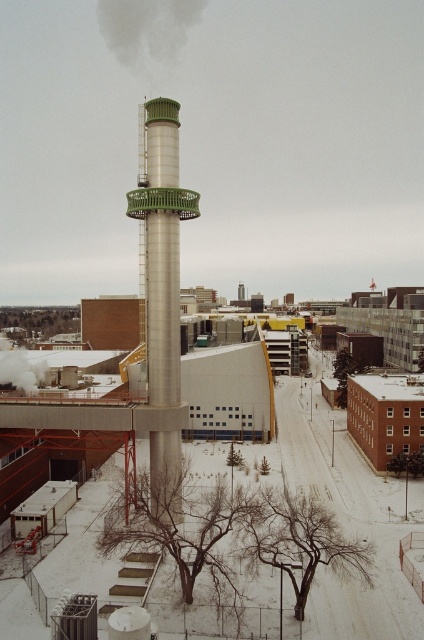
You are a drone operator tasked with capturing aerial footage of the silver metallic tower at center. The drone has a maximum flight range of 60 meters. Can the drone safely return to you after taking photos without needing a second operator?

The silver metallic tower at center is 61.07 meters away from the camera. Since the drone can only fly up to 60 meters, it cannot safely return to you after taking photos. A second operator or a different drone with a longer range is needed.

You are a delivery drone operator. Your drone is currently at point A, which is at the lower left corner of the image. You need to deliver a package to the gray matte smoke at upper center located at point B, which is at point (147, 29). However, there is a red brick building to the right of the smokestack. Is there a clear path for your drone to fly from point A to point B without going through the red brick building?

The gray matte smoke at upper center is located at point (147, 29). Since the red brick building is to the right of the smokestack and the smoke is at upper center, the drone can fly towards the smokestack area from the lower left corner, avoiding the red brick building on the right side of the smokestack. Therefore, there is a clear path available.